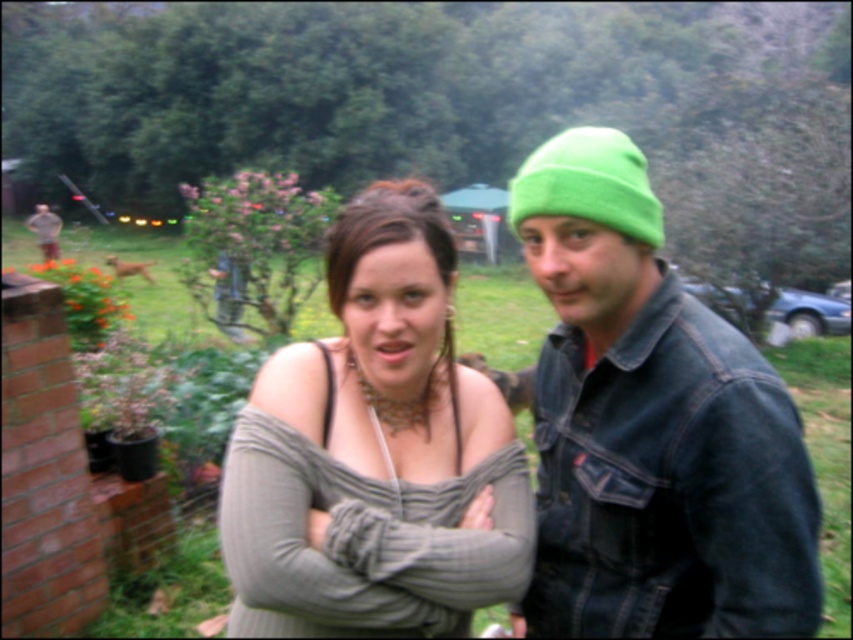
You are taking a photo of the scene and want to ensure the green knit beanie at upper right is centered in the frame. Given its current position at coordinates approximately 0.667 on the x and 0.764 on the y axis, will you need to adjust the camera to the left or right to center it horizontally?

The green knit beanie at upper right is located at point 0.667 on the x axis. To center it horizontally, you would need to adjust the camera to the left since the x coordinate is less than 0.5, indicating it is positioned to the right side of the frame.

You are a photographer trying to capture a closeup of the matte gray sweater at center and the green fleece beanie at upper right. Since you want both items to be in the frame, which direction should you move your camera to ensure both are visible?

The matte gray sweater at center is to the left of the green fleece beanie at upper right. To include both in the frame, move the camera to the left so that both the matte gray sweater at center and the green fleece beanie at upper right are visible.

You are a photographer trying to capture both the green knit beanie at upper right and the green fleece beanie at upper right in a single frame. Since the camera has a fixed focal length, you need to know which beanie is narrower to ensure both fit. Which beanie is narrower?

The green knit beanie at upper right is narrower than the green fleece beanie at upper right.